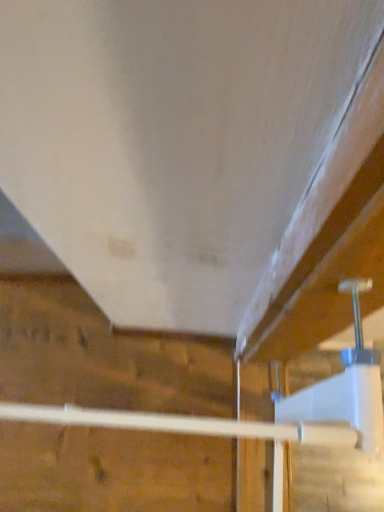
Find the location of a particular element. white plastic pipe at lower center is located at coordinates (184, 424).

What do you see at coordinates (184, 424) in the screenshot?
I see `white plastic pipe at lower center` at bounding box center [184, 424].

At what (x,y) coordinates should I click in order to perform the action: click on white plastic pipe at lower center. Please return your answer as a coordinate pair (x, y). The image size is (384, 512). Looking at the image, I should click on (184, 424).